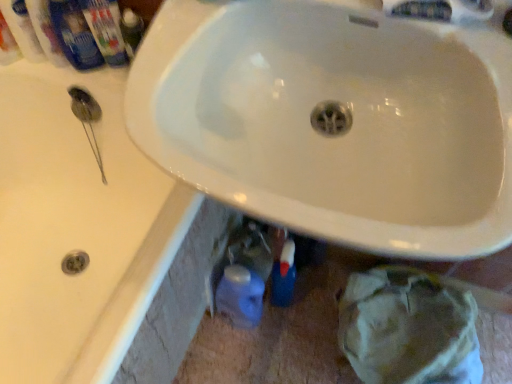
Question: From the image's perspective, is blue plastic mouthwash at upper left, the 3th mouthwash from the left, located above white plastic mouthwash at upper left, acting as the 4th mouthwash starting from the right?

Choices:
 (A) yes
 (B) no

Answer: (B)

Question: Does blue plastic mouthwash at upper left, which ranks as the 2th mouthwash in right-to-left order, have a greater width compared to white plastic mouthwash at upper left, acting as the 4th mouthwash starting from the right?

Choices:
 (A) no
 (B) yes

Answer: (B)

Question: Is blue plastic mouthwash at upper left, which ranks as the 2th mouthwash in right-to-left order, far from white plastic mouthwash at upper left, the 1th mouthwash when ordered from left to right?

Choices:
 (A) no
 (B) yes

Answer: (A)

Question: Is blue plastic mouthwash at upper left, which ranks as the 2th mouthwash in right-to-left order, outside of white plastic mouthwash at upper left, acting as the 4th mouthwash starting from the right?

Choices:
 (A) yes
 (B) no

Answer: (A)

Question: From a real-world perspective, is blue plastic mouthwash at upper left, the 3th mouthwash from the left, on white plastic mouthwash at upper left, the 1th mouthwash when ordered from left to right?

Choices:
 (A) yes
 (B) no

Answer: (B)

Question: Does point (75, 59) appear closer or farther from the camera than point (82, 205)?

Choices:
 (A) closer
 (B) farther

Answer: (A)

Question: From a real-world perspective, relative to white glossy sink at upper center, is blue plastic mouthwash at upper left, which is counted as the first mouthwash, starting from the right, vertically above or below?

Choices:
 (A) below
 (B) above

Answer: (B)

Question: From the image's perspective, relative to white glossy sink at upper center, is blue plastic mouthwash at upper left, which appears as the 4th mouthwash when viewed from the left, above or below?

Choices:
 (A) above
 (B) below

Answer: (A)

Question: Is blue plastic mouthwash at upper left, which is counted as the first mouthwash, starting from the right, wider or thinner than white glossy sink at upper center?

Choices:
 (A) thin
 (B) wide

Answer: (A)

Question: In the image, is white glossy sink at center positioned in front of or behind white glossy sink at upper center?

Choices:
 (A) behind
 (B) front

Answer: (B)

Question: Is white glossy sink at center bigger or smaller than white glossy sink at upper center?

Choices:
 (A) small
 (B) big

Answer: (A)

Question: Is white glossy sink at center taller or shorter than white glossy sink at upper center?

Choices:
 (A) short
 (B) tall

Answer: (A)

Question: Looking at their shapes, would you say white glossy sink at center is wider or thinner than white glossy sink at upper center?

Choices:
 (A) wide
 (B) thin

Answer: (B)

Question: From the image's perspective, is white glossy mouthwash at upper left, which is the second mouthwash in left-to-right order, positioned above or below white glossy sink at upper center?

Choices:
 (A) below
 (B) above

Answer: (B)

Question: Based on their positions, is white glossy mouthwash at upper left, which is the second mouthwash in left-to-right order, located to the left or right of white glossy sink at upper center?

Choices:
 (A) right
 (B) left

Answer: (B)